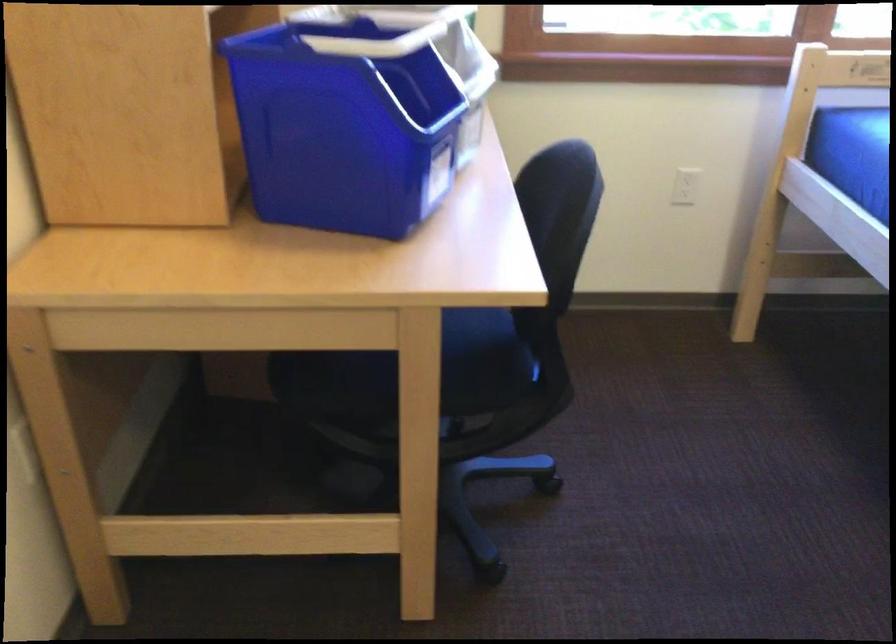
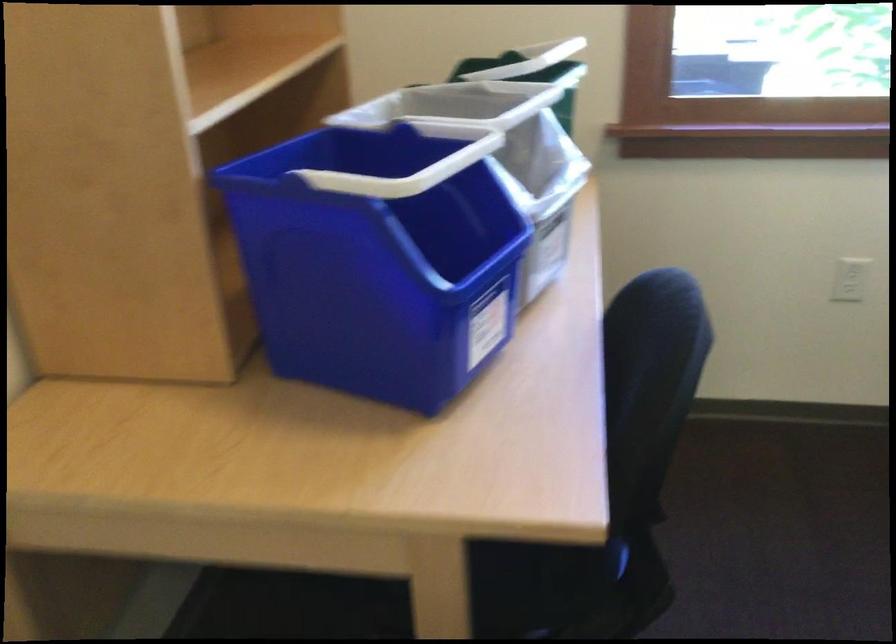
Question: The camera is either moving clockwise (left) or counter-clockwise (right) around the object. The first image is from the beginning of the video and the second image is from the end. Is the camera moving left or right when shooting the video?

Choices:
 (A) Left
 (B) Right

Answer: (B)